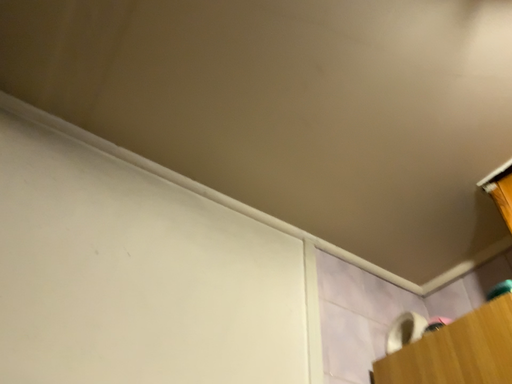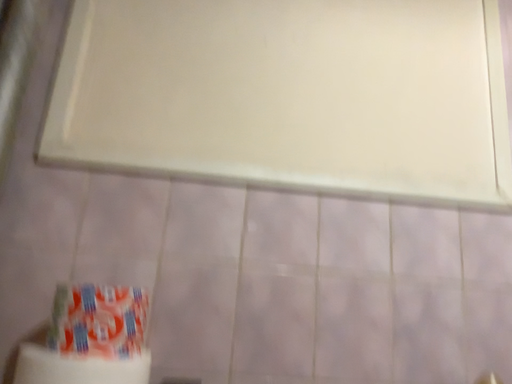
Question: How did the camera likely rotate when shooting the video?

Choices:
 (A) rotated upward
 (B) rotated downward

Answer: (B)